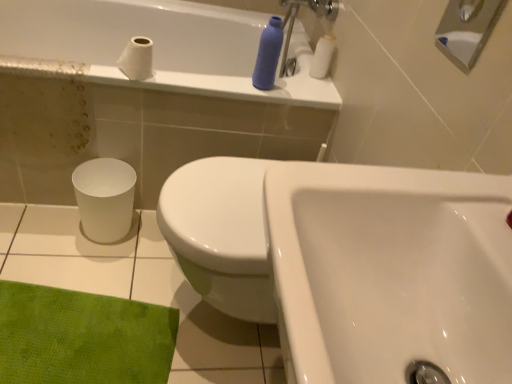
Question: In the image, is white ceramic tile at lower left on the left side or the right side of white matte toilet paper at upper left, the first toilet paper when ordered from front to back?

Choices:
 (A) right
 (B) left

Answer: (B)

Question: Considering their positions, is white ceramic tile at lower left located in front of or behind white matte toilet paper at upper left, marked as the 2th toilet paper in a right-to-left arrangement?

Choices:
 (A) behind
 (B) front

Answer: (B)

Question: Which object is the closest to the white ceramic tile at lower left?

Choices:
 (A) brushed metal shower at upper right
 (B) white glossy sink at center
 (C) white glossy bathtub at upper center
 (D) matte plastic bottle at upper center
 (E) white matte toilet paper at upper right, the first toilet paper viewed from the right

Answer: (C)

Question: Estimate the real-world distances between objects in this image. Which object is closer to the white glossy sink at center?

Choices:
 (A) white ceramic tile at lower left
 (B) white matte toilet paper at upper right, which ranks as the 2th toilet paper in left-to-right order
 (C) white glossy bathtub at upper center
 (D) brushed metal shower at upper right
 (E) white matte toilet paper at upper left, the first toilet paper when ordered from front to back

Answer: (D)